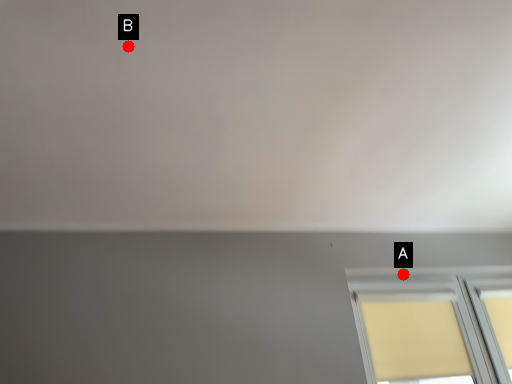
Question: Two points are circled on the image, labeled by A and B beside each circle. Which point is farther from the camera taking this photo?

Choices:
 (A) A is further
 (B) B is further

Answer: (A)